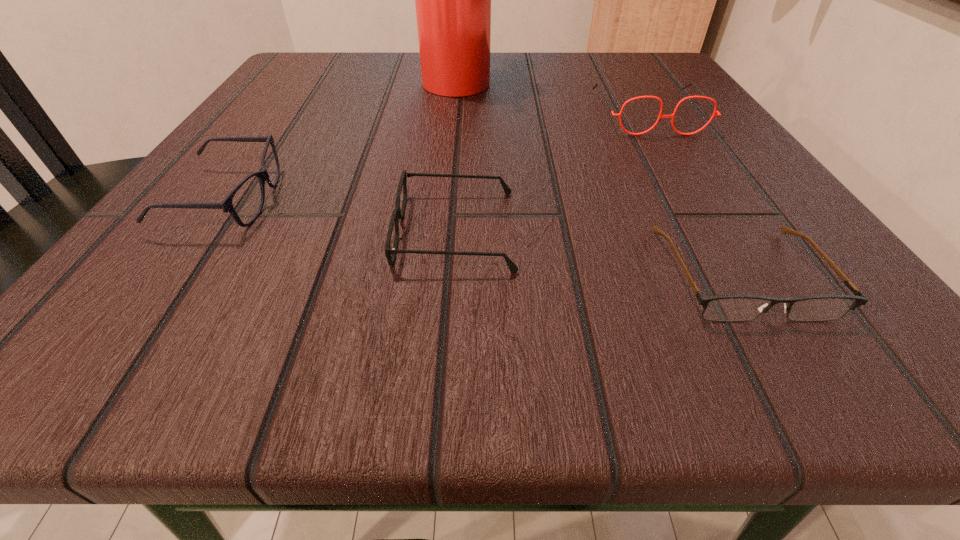
The width and height of the screenshot is (960, 540). Find the location of `vacant space located on the front-facing side of the second spectacles from left to right`. vacant space located on the front-facing side of the second spectacles from left to right is located at coordinates (345, 230).

Locate an element on the screen. vacant space situated on the front-facing side of the second spectacles from left to right is located at coordinates (222, 230).

In order to click on fire extinguisher at the far edge in this screenshot , I will do `click(452, 0)`.

I want to click on spectacles that is at the far edge, so click(x=703, y=96).

I want to click on object present at the near edge, so [x=736, y=307].

I want to click on object at the left edge, so click(226, 205).

The image size is (960, 540). Find the location of `object situated at the far right corner`. object situated at the far right corner is located at coordinates point(703,96).

Image resolution: width=960 pixels, height=540 pixels. Identify the location of object at the near right corner. (736, 307).

In the image, there is a desktop. Where is `vacant space at the far edge`? Image resolution: width=960 pixels, height=540 pixels. vacant space at the far edge is located at coordinates (507, 65).

Image resolution: width=960 pixels, height=540 pixels. Identify the location of free space at the near edge. (399, 345).